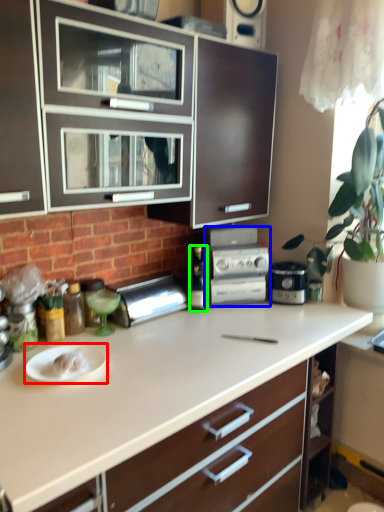
Question: Based on their relative distances, which object is nearer to paper plate (highlighted by a red box)? Choose from kitchen appliance (highlighted by a blue box) and bottle (highlighted by a green box).

Choices:
 (A) kitchen appliance
 (B) bottle

Answer: (B)